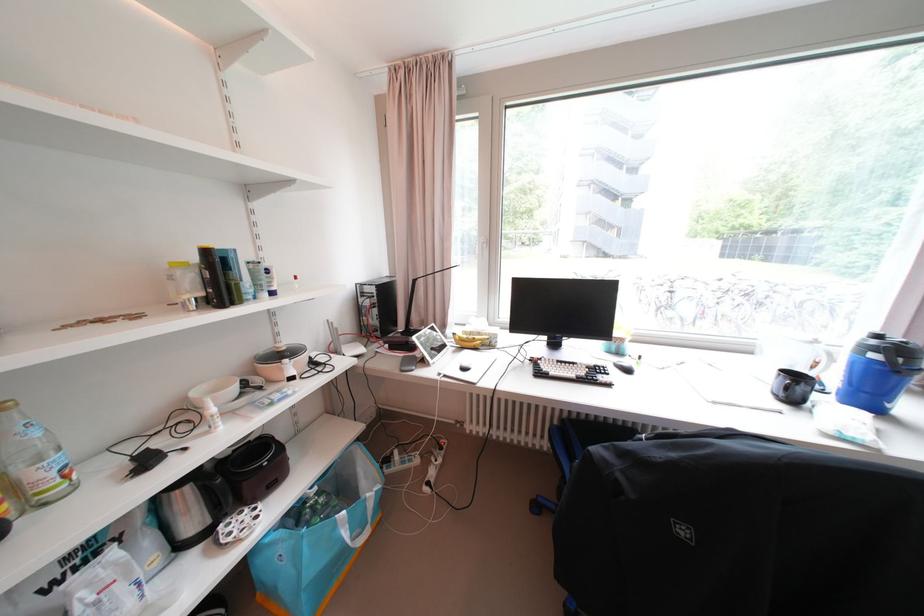
At what (x,y) coordinates should I click in order to perform the action: click on black pot handle. Please return your answer as a coordinate pair (x, y). The image size is (924, 616). Looking at the image, I should click on (216, 492).